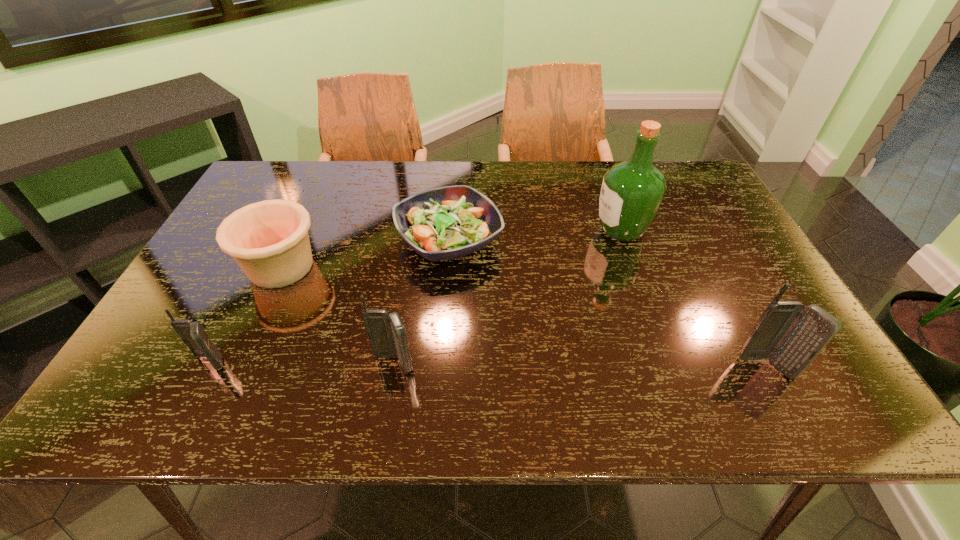
You are a GUI agent. You are given a task and a screenshot of the screen. Output one action in this format:
    pyautogui.click(x=<x>, y=<y>)
    Task: Click on the shortest cellular telephone
    This screenshot has width=960, height=540.
    Given the screenshot: What is the action you would take?
    pos(193,334)

I want to click on the second shortest cellular telephone, so click(386, 331).

Where is `the third tallest object`? The image size is (960, 540). the third tallest object is located at coordinates (386, 331).

Where is `the second tallest object`? The height and width of the screenshot is (540, 960). the second tallest object is located at coordinates 791,335.

The image size is (960, 540). In order to click on the rightmost object in this screenshot , I will do `click(791, 335)`.

Image resolution: width=960 pixels, height=540 pixels. In order to click on salad plate in this screenshot , I will do `click(444, 223)`.

In order to click on the tallest object in this screenshot , I will do `click(632, 191)`.

You are a GUI agent. You are given a task and a screenshot of the screen. Output one action in this format:
    pyautogui.click(x=<x>, y=<y>)
    Task: Click on the liquor
    This screenshot has width=960, height=540.
    Given the screenshot: What is the action you would take?
    pyautogui.click(x=632, y=191)

You are a GUI agent. You are given a task and a screenshot of the screen. Output one action in this format:
    pyautogui.click(x=<x>, y=<y>)
    Task: Click on the pottery
    Image resolution: width=960 pixels, height=540 pixels.
    Given the screenshot: What is the action you would take?
    pyautogui.click(x=269, y=240)

Locate an element on the screen. The width and height of the screenshot is (960, 540). free space located on the front of the salad plate is located at coordinates (444, 311).